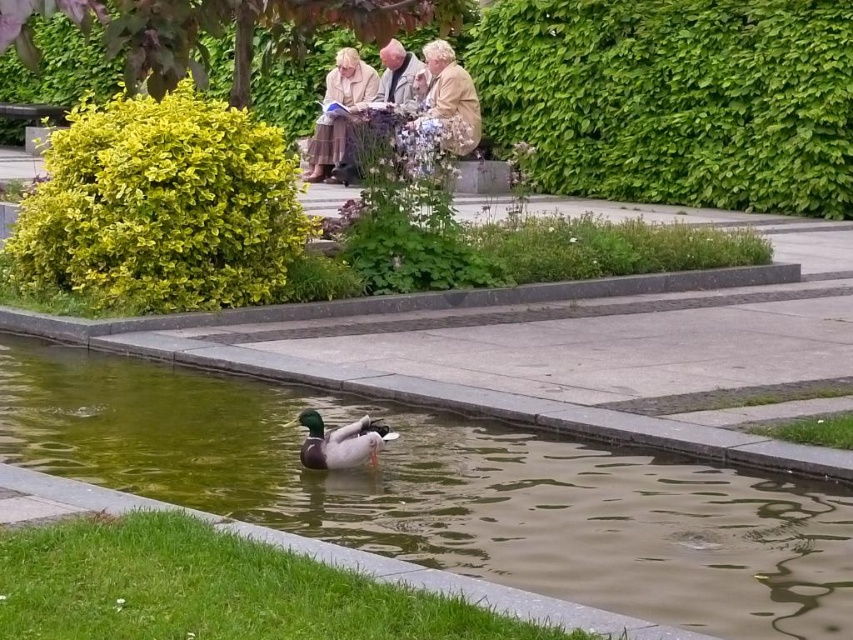
Question: Can you confirm if light beige fabric coat at upper center is positioned above light beige fabric jacket at upper center?

Choices:
 (A) no
 (B) yes

Answer: (A)

Question: Which of these objects is positioned closest to the greenish water at duck center?

Choices:
 (A) light beige jacket at center
 (B) green glossy duck at center
 (C) light beige fabric coat at center

Answer: (B)

Question: Estimate the real-world distances between objects in this image. Which object is closer to the light beige fabric coat at upper center?

Choices:
 (A) greenish water at duck center
 (B) light beige fabric coat at center
 (C) light beige jacket at center

Answer: (B)

Question: Does greenish water at duck center have a greater width compared to green glossy duck at center?

Choices:
 (A) no
 (B) yes

Answer: (B)

Question: Which is nearer to the light beige fabric jacket at upper center?

Choices:
 (A) green glossy duck at center
 (B) light beige fabric coat at center

Answer: (B)

Question: Is greenish water at duck center positioned at the back of light beige jacket at center?

Choices:
 (A) yes
 (B) no

Answer: (B)